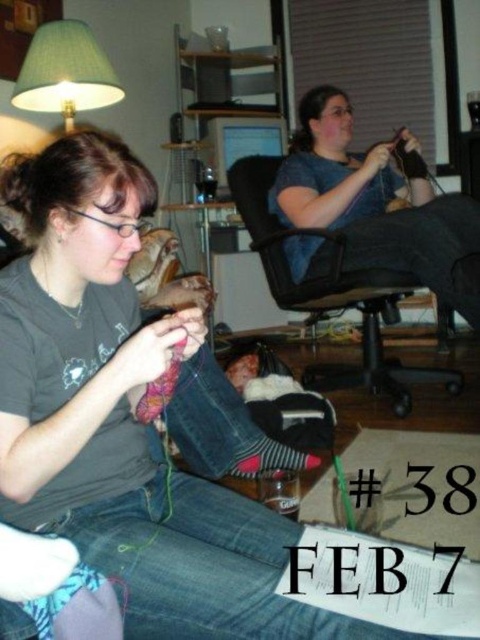
Question: Which of the following is the closest to the observer?

Choices:
 (A) denim at left
 (B) green fabric lampshade at upper left

Answer: (A)

Question: Can you confirm if black mesh office chair at center is bigger than green fabric lampshade at upper left?

Choices:
 (A) yes
 (B) no

Answer: (A)

Question: Which of the following is the farthest from the observer?

Choices:
 (A) (156, 486)
 (B) (83, 36)

Answer: (B)

Question: Does denim at left appear over matte blue shirt at upper right?

Choices:
 (A) no
 (B) yes

Answer: (A)

Question: Is denim at left behind matte blue shirt at upper right?

Choices:
 (A) no
 (B) yes

Answer: (A)

Question: Which point is farther to the camera?

Choices:
 (A) green fabric lampshade at upper left
 (B) denim at left

Answer: (A)